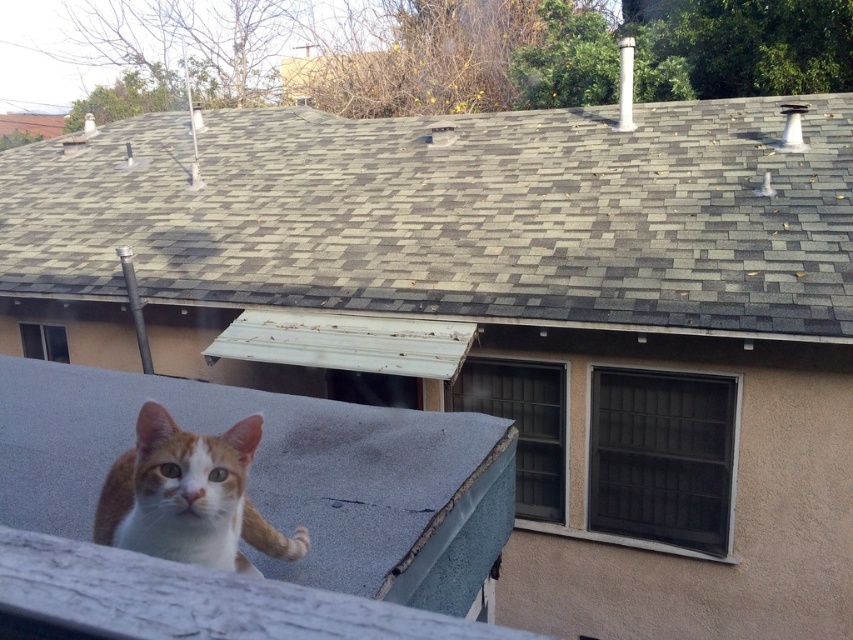
Which is above, gray shingles at upper center or orange tabby cat at lower left?

gray shingles at upper center is above.

Who is more forward, (254,291) or (236,435)?

Positioned in front is point (236,435).

Describe the element at coordinates (456, 216) in the screenshot. This screenshot has height=640, width=853. I see `gray shingles at upper center` at that location.

This screenshot has height=640, width=853. What are the coordinates of `gray shingles at upper center` in the screenshot? It's located at click(x=456, y=216).